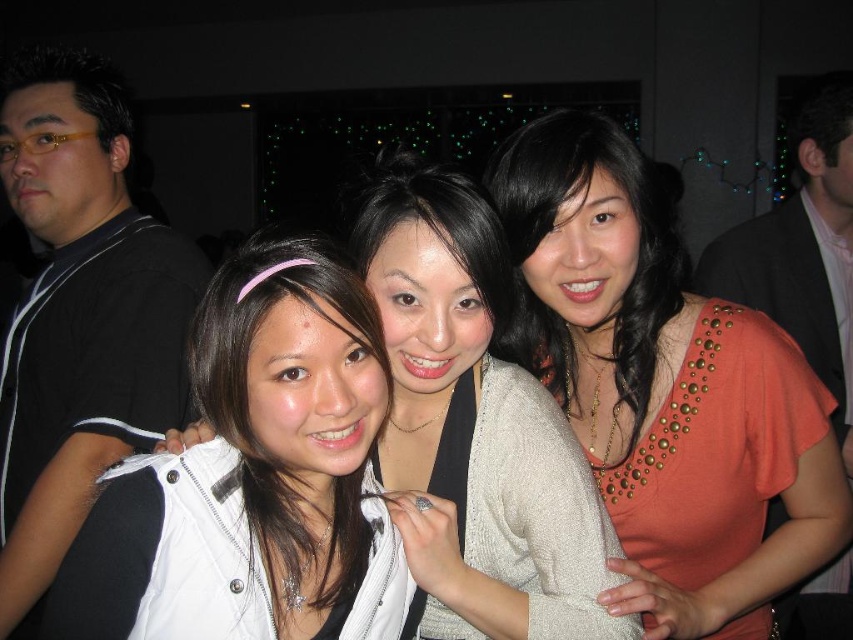
Question: Among these points, which one is nearest to the camera?

Choices:
 (A) (819, 134)
 (B) (283, 365)
 (C) (183, 275)

Answer: (B)

Question: Does orange studded top at center come in front of white fabric jacket at center?

Choices:
 (A) yes
 (B) no

Answer: (B)

Question: Which of the following is the closest to the observer?

Choices:
 (A) (106, 525)
 (B) (466, 536)

Answer: (A)

Question: Can you confirm if orange studded top at center is thinner than white matte jacket at center?

Choices:
 (A) yes
 (B) no

Answer: (B)

Question: Estimate the real-world distances between objects in this image. Which object is farther from the black suit jacket at upper right?

Choices:
 (A) black matte shirt at left
 (B) orange studded top at center
 (C) white fabric jacket at center
 (D) white matte jacket at center

Answer: (A)

Question: Is white fabric jacket at center closer to camera compared to black matte shirt at left?

Choices:
 (A) no
 (B) yes

Answer: (B)